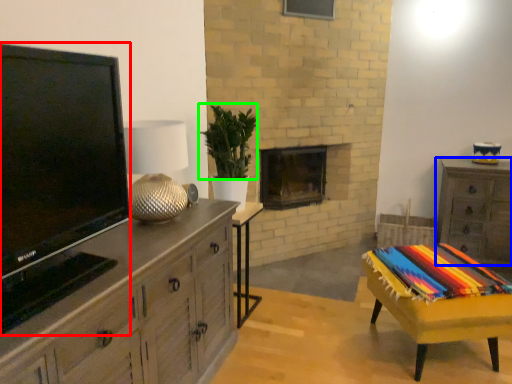
Question: Estimate the real-world distances between objects in this image. Which object is farther from television (highlighted by a red box), chest of drawers (highlighted by a blue box) or plant (highlighted by a green box)?

Choices:
 (A) chest of drawers
 (B) plant

Answer: (A)